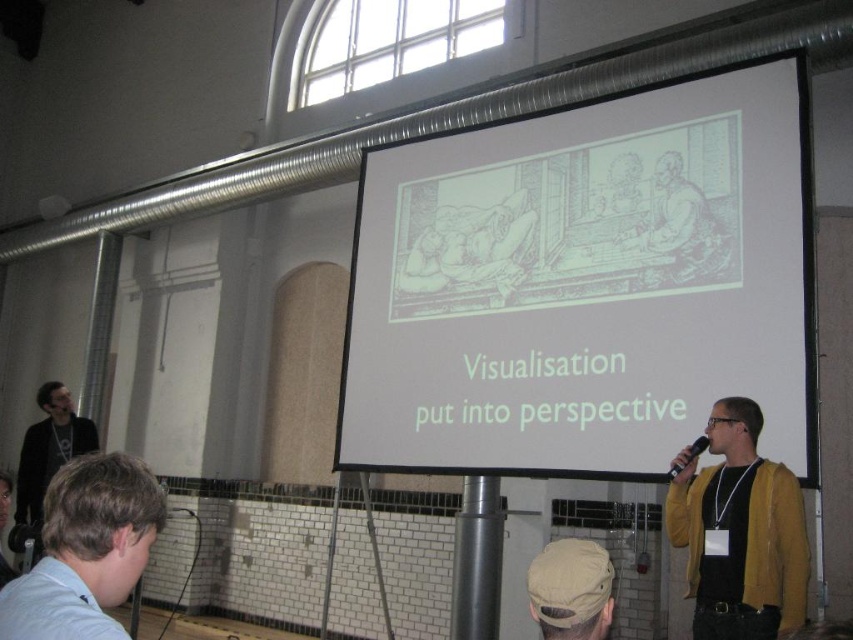
Question: Is white paper at center thinner than khaki fabric cap at center?

Choices:
 (A) yes
 (B) no

Answer: (B)

Question: Which object is positioned farthest from the khaki fabric cap at center?

Choices:
 (A) light blue shirt at lower left
 (B) white paper at center
 (C) black leather jacket at left
 (D) yellow cardigan at right

Answer: (C)

Question: Which point appears closest to the camera in this image?

Choices:
 (A) (694, 449)
 (B) (795, 390)

Answer: (A)

Question: Observing the image, what is the correct spatial positioning of yellow cardigan at right in reference to light blue shirt at lower left?

Choices:
 (A) right
 (B) left

Answer: (A)

Question: Can you confirm if yellow cardigan at right is smaller than light blue shirt at lower left?

Choices:
 (A) yes
 (B) no

Answer: (B)

Question: Which point is farther to the camera?

Choices:
 (A) black plastic microphone at center
 (B) yellow cardigan at right
 (C) white paper at center
 (D) khaki fabric cap at center

Answer: (C)